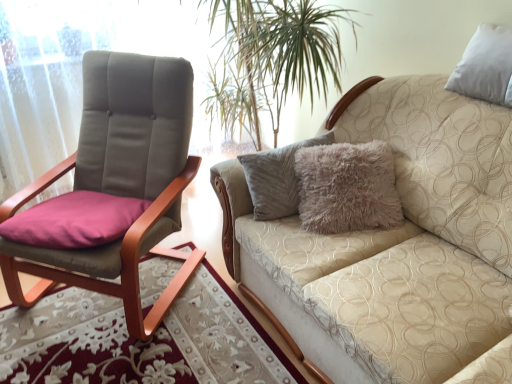
Question: Looking at the image, does beige textured couch at upper right seem bigger or smaller compared to matte gray fabric chair at left?

Choices:
 (A) big
 (B) small

Answer: (A)

Question: Considering the relative positions of beige textured couch at upper right and matte gray fabric chair at left in the image provided, is beige textured couch at upper right to the left or to the right of matte gray fabric chair at left?

Choices:
 (A) right
 (B) left

Answer: (A)

Question: Is beige textured couch at upper right taller or shorter than matte gray fabric chair at left?

Choices:
 (A) short
 (B) tall

Answer: (A)

Question: In the image, is matte gray fabric chair at left positioned in front of or behind beige textured couch at upper right?

Choices:
 (A) behind
 (B) front

Answer: (A)

Question: Is matte gray fabric chair at left inside or outside of beige textured couch at upper right?

Choices:
 (A) inside
 (B) outside

Answer: (B)

Question: Considering the positions of matte gray fabric chair at left and beige textured couch at upper right in the image, is matte gray fabric chair at left wider or thinner than beige textured couch at upper right?

Choices:
 (A) wide
 (B) thin

Answer: (B)

Question: In terms of size, does matte gray fabric chair at left appear bigger or smaller than beige textured couch at upper right?

Choices:
 (A) small
 (B) big

Answer: (A)